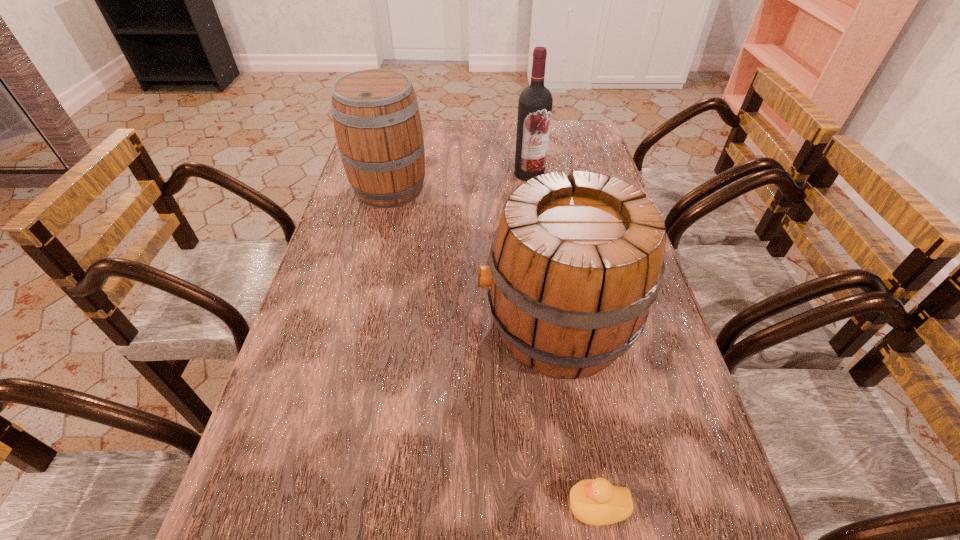
Find the location of a particular element. free spot between the left cider and the tallest object is located at coordinates (460, 181).

At what (x,y) coordinates should I click in order to perform the action: click on vacant point located between the left cider and the wine bottle. Please return your answer as a coordinate pair (x, y). The height and width of the screenshot is (540, 960). Looking at the image, I should click on (460, 181).

Find the location of a particular element. The image size is (960, 540). free point between the duck and the farther cider is located at coordinates (493, 347).

At what (x,y) coordinates should I click in order to perform the action: click on free space between the duck and the leftmost object. Please return your answer as a coordinate pair (x, y). Looking at the image, I should click on (493, 347).

The image size is (960, 540). In order to click on free space between the leftmost object and the nearer cider in this screenshot , I will do `click(473, 258)`.

You are a GUI agent. You are given a task and a screenshot of the screen. Output one action in this format:
    pyautogui.click(x=<x>, y=<y>)
    Task: Click on the free space between the nearest object and the third farthest object
    This screenshot has height=540, width=960.
    Given the screenshot: What is the action you would take?
    pyautogui.click(x=577, y=416)

At what (x,y) coordinates should I click in order to perform the action: click on vacant area that lies between the left cider and the shortest object. Please return your answer as a coordinate pair (x, y). Image resolution: width=960 pixels, height=540 pixels. Looking at the image, I should click on (493, 347).

Image resolution: width=960 pixels, height=540 pixels. What are the coordinates of `object that stands as the second closest to the wine bottle` in the screenshot? It's located at (x=574, y=265).

Locate an element on the screen. object that stands as the second closest to the right cider is located at coordinates (377, 123).